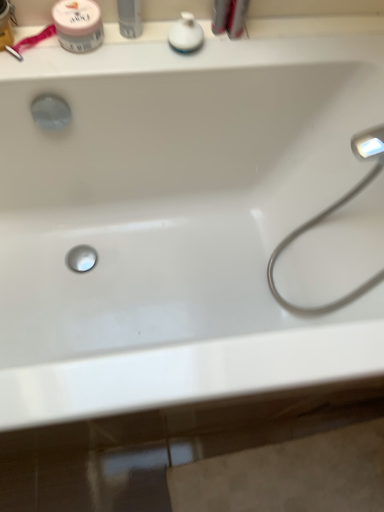
Where is `free space on the front side of pink matte jar at upper left`? free space on the front side of pink matte jar at upper left is located at coordinates (64, 70).